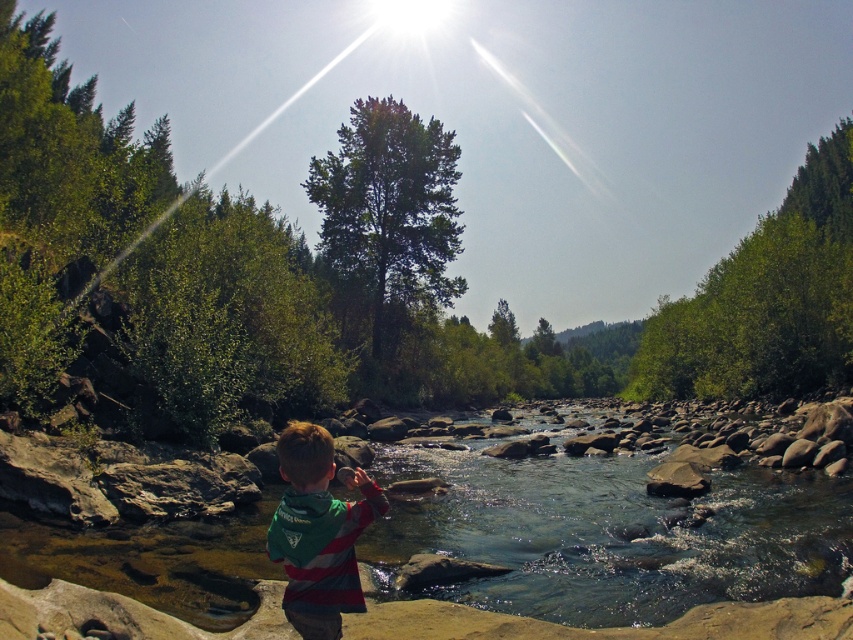
Does clear water at center have a smaller size compared to striped jersey boy at center?

No.

Is point (468, 595) closer to viewer compared to point (363, 477)?

No, (468, 595) is further to viewer.

Is point (683, 600) closer to viewer compared to point (334, 588)?

That is False.

Locate an element on the screen. clear water at center is located at coordinates (596, 545).